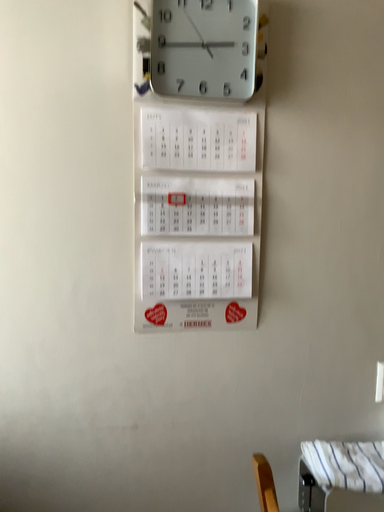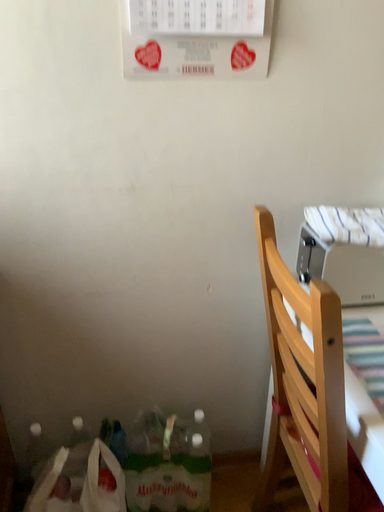
Question: How did the camera likely rotate when shooting the video?

Choices:
 (A) rotated upward
 (B) rotated downward

Answer: (B)